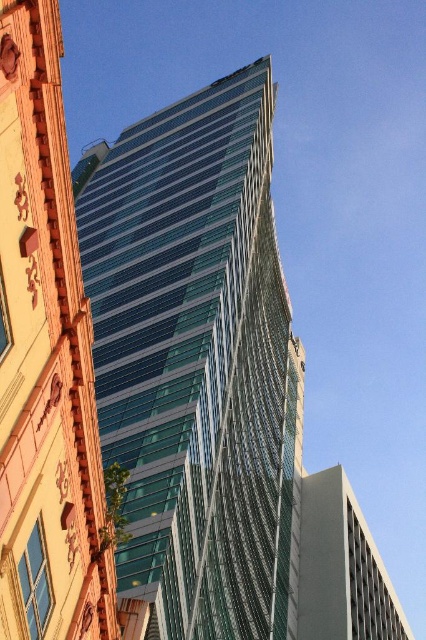
Which is above, transparent glass tower at center or transparent glass building at upper center?

transparent glass tower at center is above.

Is transparent glass tower at center closer to the viewer compared to transparent glass building at upper center?

No, transparent glass tower at center is behind transparent glass building at upper center.

Describe the element at coordinates (198, 364) in the screenshot. I see `transparent glass tower at center` at that location.

Where is `transparent glass tower at center`? The image size is (426, 640). transparent glass tower at center is located at coordinates (198, 364).